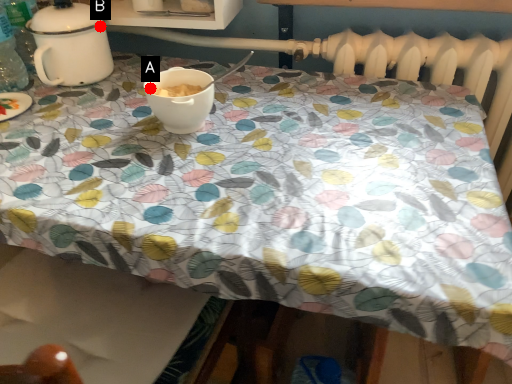
Question: Two points are circled on the image, labeled by A and B beside each circle. Which point is farther to the camera?

Choices:
 (A) A is further
 (B) B is further

Answer: (B)